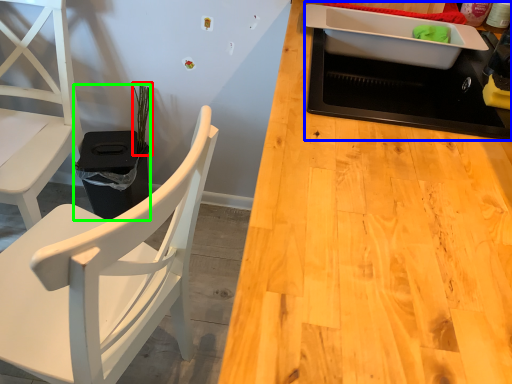
Question: Which is farther away from plant (highlighted by a red box)? appliance (highlighted by a blue box) or houseplant (highlighted by a green box)?

Choices:
 (A) appliance
 (B) houseplant

Answer: (A)